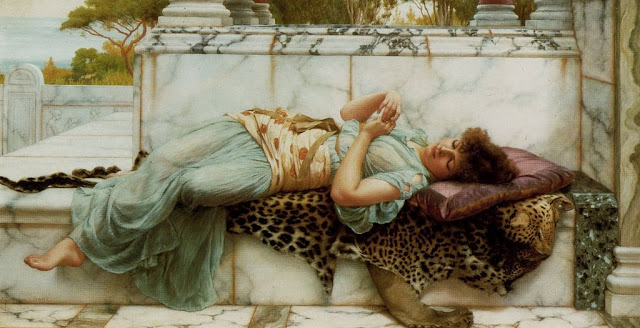
The height and width of the screenshot is (328, 640). What are the coordinates of `pillow` in the screenshot? It's located at (538, 165).